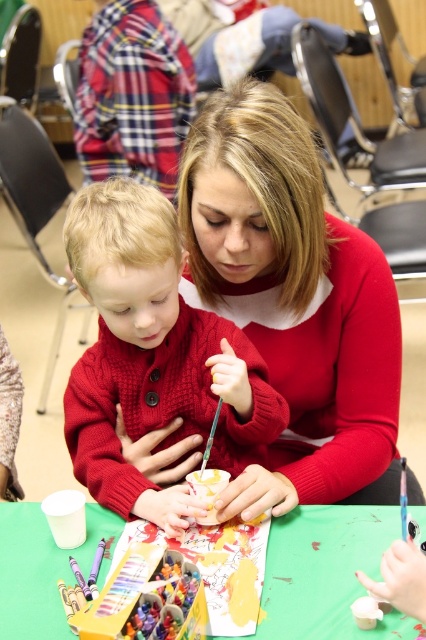
You are standing in front of the table and notice the matte red sweater at center. Can you determine its exact position on the table using the coordinate system provided?

The matte red sweater at center is located at point [293,300] according to the coordinate system provided.